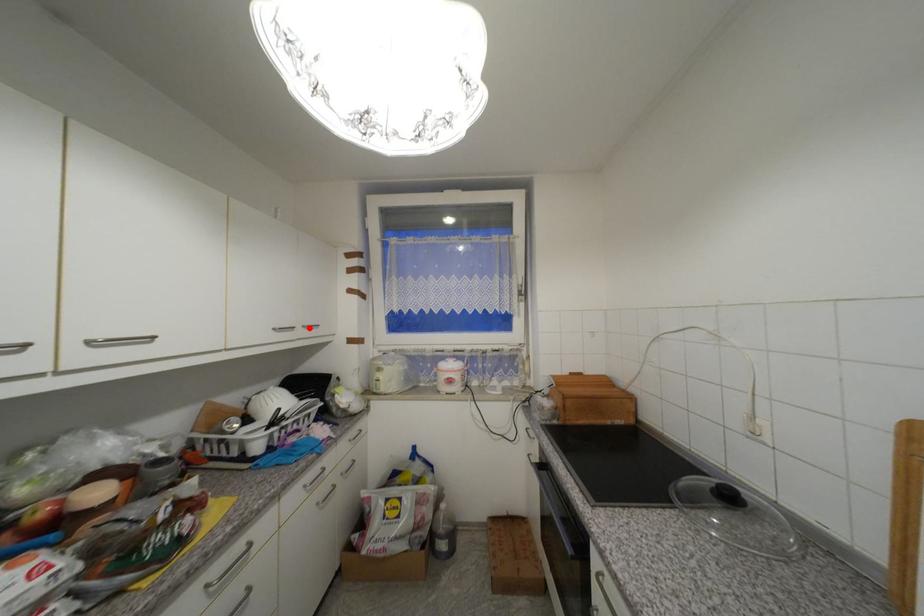
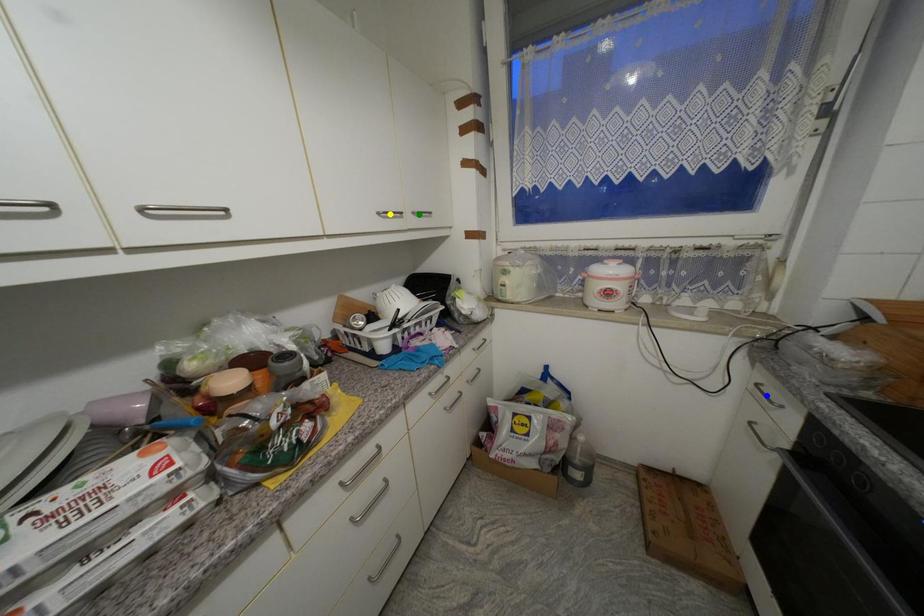
Question: I am providing you with two images of the same scene from different viewpoints. A red point is marked on the first image. You are given multiple points on the second image. Which spot in image 2 lines up with the point in image 1?

Choices:
 (A) yellow point
 (B) green point
 (C) blue point

Answer: (B)